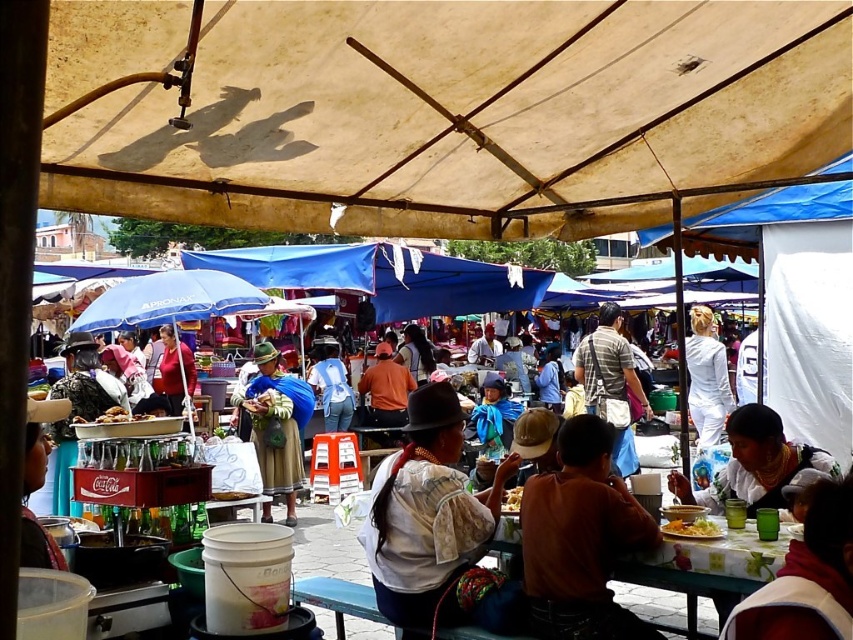
You are a food vendor at the market and want to ensure your yellowish matte food at center is visible to customers passing by the white floral tablecloth at center. Considering their heights, which item would customers see first when looking at the table?

The white floral tablecloth at center is taller than the yellowish matte food at center, so customers would see the white floral tablecloth at center first when looking at the table.

You are a photographer standing at the entrance of the market. You want to capture a photo that includes both the white fabric at lower right and the yellowish matte food at center. Which object should you position closer to the left side of your camera frame to include both in the shot?

To include both the white fabric at lower right and the yellowish matte food at center in the shot, you should position the yellowish matte food at center closer to the left side of your camera frame since the white fabric at lower right is located to the right of it.

You are a food vendor at the market and want to place a new dish on the table with the white floral tablecloth at center. However, you notice the yellowish matte food at center is already there. Can you place your dish in front of the existing food without moving it?

The white floral tablecloth at center is already in front of the yellowish matte food at center, so placing your dish there would mean it is behind the existing food. To place your dish in front of the yellowish matte food at center without moving it, you would need to position it in front of both the tablecloth and the existing food.